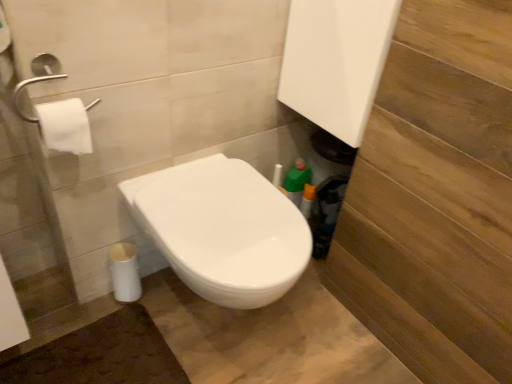
Question: Is white glossy toilet at center in front of or behind white matte toilet paper at upper left in the image?

Choices:
 (A) front
 (B) behind

Answer: (A)

Question: Considering the positions of white glossy toilet at center and white matte toilet paper at upper left in the image, is white glossy toilet at center taller or shorter than white matte toilet paper at upper left?

Choices:
 (A) short
 (B) tall

Answer: (B)

Question: From the image's perspective, is white glossy toilet at center above or below white matte toilet paper at upper left?

Choices:
 (A) below
 (B) above

Answer: (A)

Question: Would you say white matte toilet paper at upper left is to the left or to the right of white glossy toilet at center in the picture?

Choices:
 (A) right
 (B) left

Answer: (B)

Question: Is white matte toilet paper at upper left in front of or behind white glossy toilet at center in the image?

Choices:
 (A) front
 (B) behind

Answer: (B)

Question: From the image's perspective, is white matte toilet paper at upper left positioned above or below white glossy toilet at center?

Choices:
 (A) below
 (B) above

Answer: (B)

Question: Considering the positions of point [x=72, y=112] and point [x=185, y=256], is point [x=72, y=112] closer or farther from the camera than point [x=185, y=256]?

Choices:
 (A) farther
 (B) closer

Answer: (B)